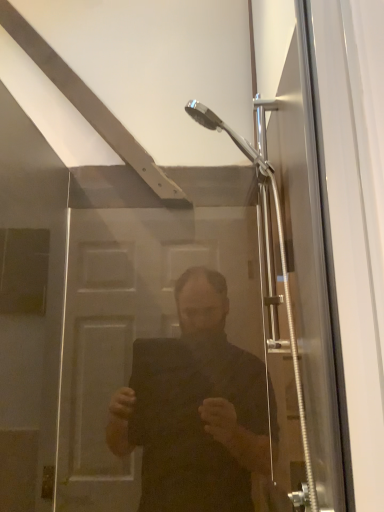
This screenshot has height=512, width=384. What do you see at coordinates (281, 261) in the screenshot?
I see `clear glass shower door at center` at bounding box center [281, 261].

Measure the distance between clear glass shower door at center and camera.

clear glass shower door at center is 32.18 inches away from camera.

At what (x,y) coordinates should I click in order to perform the action: click on clear glass shower door at center. Please return your answer as a coordinate pair (x, y). This screenshot has width=384, height=512. Looking at the image, I should click on (281, 261).

Identify the location of clear glass shower door at center. This screenshot has width=384, height=512. (281, 261).